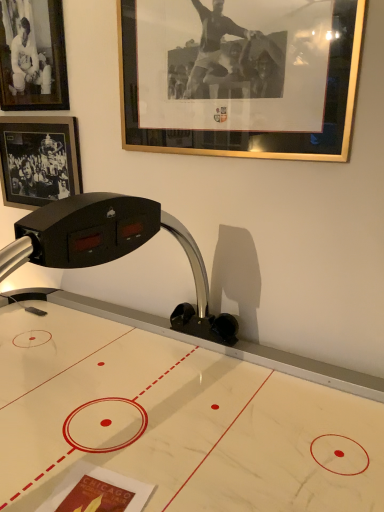
The height and width of the screenshot is (512, 384). Describe the element at coordinates (32, 56) in the screenshot. I see `matte black photo frame at upper left, positioned as the 2th picture frame in right-to-left order` at that location.

Identify the location of black matte picture frame at upper left, the first picture frame when ordered from left to right. (39, 160).

This screenshot has height=512, width=384. In order to click on white glossy air hockey table at center in this screenshot , I will do `click(175, 421)`.

The width and height of the screenshot is (384, 512). What do you see at coordinates (240, 76) in the screenshot? I see `gold-framed picture at upper center, placed as the third picture frame when sorted from left to right` at bounding box center [240, 76].

Locate an element on the screen. Image resolution: width=384 pixels, height=512 pixels. matte black photo frame at upper left, which appears as the 2th picture frame when viewed from the left is located at coordinates (32, 56).

Is the position of matte black photo frame at upper left, which appears as the 2th picture frame when viewed from the left, less distant than that of gold-framed picture at upper center, which ranks as the 1th picture frame in right-to-left order?

No.

Does matte black photo frame at upper left, which appears as the 2th picture frame when viewed from the left, have a smaller size compared to gold-framed picture at upper center, which ranks as the 1th picture frame in right-to-left order?

Indeed, matte black photo frame at upper left, which appears as the 2th picture frame when viewed from the left, has a smaller size compared to gold-framed picture at upper center, which ranks as the 1th picture frame in right-to-left order.

Locate an element on the screen. This screenshot has width=384, height=512. picture frame in front of the matte black photo frame at upper left, which appears as the 2th picture frame when viewed from the left is located at coordinates (240, 76).

How different are the orientations of matte black photo frame at upper left, positioned as the 2th picture frame in right-to-left order, and gold-framed picture at upper center, which ranks as the 1th picture frame in right-to-left order, in degrees?

The facing directions of matte black photo frame at upper left, positioned as the 2th picture frame in right-to-left order, and gold-framed picture at upper center, which ranks as the 1th picture frame in right-to-left order, are 0.0114 degrees apart.

Find the location of a particular element. This screenshot has height=512, width=384. picture frame that is the 2nd one above the white glossy air hockey table at center (from a real-world perspective) is located at coordinates (240, 76).

From the picture: What's the angular difference between gold-framed picture at upper center, which ranks as the 1th picture frame in right-to-left order, and white glossy air hockey table at center's facing directions?

gold-framed picture at upper center, which ranks as the 1th picture frame in right-to-left order, and white glossy air hockey table at center are facing 0.368 degrees away from each other.

From the picture: In terms of height, does gold-framed picture at upper center, which ranks as the 1th picture frame in right-to-left order, look taller or shorter compared to white glossy air hockey table at center?

Considering their sizes, gold-framed picture at upper center, which ranks as the 1th picture frame in right-to-left order, has less height than white glossy air hockey table at center.

Is point (277, 61) closer to viewer compared to point (40, 305)?

That is True.

Does black matte picture frame at upper left, arranged as the third picture frame when viewed from the right, have a lesser height compared to gold-framed picture at upper center, which ranks as the 1th picture frame in right-to-left order?

Indeed, black matte picture frame at upper left, arranged as the third picture frame when viewed from the right, has a lesser height compared to gold-framed picture at upper center, which ranks as the 1th picture frame in right-to-left order.

Is black matte picture frame at upper left, the first picture frame when ordered from left to right, aimed at gold-framed picture at upper center, which ranks as the 1th picture frame in right-to-left order?

No, black matte picture frame at upper left, the first picture frame when ordered from left to right, is not aimed at gold-framed picture at upper center, which ranks as the 1th picture frame in right-to-left order.

Would you say gold-framed picture at upper center, which ranks as the 1th picture frame in right-to-left order, is part of black matte picture frame at upper left, arranged as the third picture frame when viewed from the right,'s contents?

That's incorrect, gold-framed picture at upper center, which ranks as the 1th picture frame in right-to-left order, is not inside black matte picture frame at upper left, arranged as the third picture frame when viewed from the right.

Is gold-framed picture at upper center, which ranks as the 1th picture frame in right-to-left order, spatially inside matte black photo frame at upper left, which appears as the 2th picture frame when viewed from the left, or outside of it?

The correct answer is: outside.

From a real-world perspective, who is located higher, gold-framed picture at upper center, placed as the third picture frame when sorted from left to right, or matte black photo frame at upper left, positioned as the 2th picture frame in right-to-left order?

matte black photo frame at upper left, positioned as the 2th picture frame in right-to-left order, from a real-world perspective.

At what (x,y) coordinates should I click in order to perform the action: click on picture frame on the right of the matte black photo frame at upper left, which appears as the 2th picture frame when viewed from the left. Please return your answer as a coordinate pair (x, y). Looking at the image, I should click on (240, 76).

From the image's perspective, is gold-framed picture at upper center, which ranks as the 1th picture frame in right-to-left order, below matte black photo frame at upper left, which appears as the 2th picture frame when viewed from the left?

Correct, gold-framed picture at upper center, which ranks as the 1th picture frame in right-to-left order, appears lower than matte black photo frame at upper left, which appears as the 2th picture frame when viewed from the left, in the image.

Which object is thinner, white glossy air hockey table at center or matte black photo frame at upper left, positioned as the 2th picture frame in right-to-left order?

matte black photo frame at upper left, positioned as the 2th picture frame in right-to-left order, is thinner.

Which is more to the left, white glossy air hockey table at center or matte black photo frame at upper left, which appears as the 2th picture frame when viewed from the left?

From the viewer's perspective, matte black photo frame at upper left, which appears as the 2th picture frame when viewed from the left, appears more on the left side.

Does white glossy air hockey table at center have a smaller size compared to matte black photo frame at upper left, positioned as the 2th picture frame in right-to-left order?

Incorrect, white glossy air hockey table at center is not smaller in size than matte black photo frame at upper left, positioned as the 2th picture frame in right-to-left order.

From the picture: How many degrees apart are the facing directions of white glossy air hockey table at center and gold-framed picture at upper center, placed as the third picture frame when sorted from left to right?

0.368 degrees.

Consider the image. Who is more distant, white glossy air hockey table at center or gold-framed picture at upper center, which ranks as the 1th picture frame in right-to-left order?

gold-framed picture at upper center, which ranks as the 1th picture frame in right-to-left order.

This screenshot has width=384, height=512. Identify the location of table below the gold-framed picture at upper center, which ranks as the 1th picture frame in right-to-left order (from a real-world perspective). pos(175,421).

Does black matte picture frame at upper left, arranged as the third picture frame when viewed from the right, contain matte black photo frame at upper left, which appears as the 2th picture frame when viewed from the left?

No, matte black photo frame at upper left, which appears as the 2th picture frame when viewed from the left, is located outside of black matte picture frame at upper left, arranged as the third picture frame when viewed from the right.

From a real-world perspective, does black matte picture frame at upper left, the first picture frame when ordered from left to right, sit lower than matte black photo frame at upper left, which appears as the 2th picture frame when viewed from the left?

Correct, in the physical world, black matte picture frame at upper left, the first picture frame when ordered from left to right, is lower than matte black photo frame at upper left, which appears as the 2th picture frame when viewed from the left.

From a real-world perspective, count 2nd picture frames upward from the black matte picture frame at upper left, the first picture frame when ordered from left to right, and point to it. Please provide its 2D coordinates.

[(32, 56)]

You are a GUI agent. You are given a task and a screenshot of the screen. Output one action in this format:
    pyautogui.click(x=<x>, y=<y>)
    Task: Click on the 1st picture frame below when counting from the matte black photo frame at upper left, which appears as the 2th picture frame when viewed from the left (from the image's perspective)
    This screenshot has width=384, height=512.
    Given the screenshot: What is the action you would take?
    pyautogui.click(x=240, y=76)

From the image's perspective, count 2nd picture frames upward from the white glossy air hockey table at center and point to it. Please provide its 2D coordinates.

[(240, 76)]

In the scene shown: Considering their positions, is matte black photo frame at upper left, positioned as the 2th picture frame in right-to-left order, positioned closer to gold-framed picture at upper center, which ranks as the 1th picture frame in right-to-left order, than black matte picture frame at upper left, the first picture frame when ordered from left to right?

Among the two, matte black photo frame at upper left, positioned as the 2th picture frame in right-to-left order, is located nearer to gold-framed picture at upper center, which ranks as the 1th picture frame in right-to-left order.

Considering their positions, is white glossy air hockey table at center positioned closer to black matte picture frame at upper left, arranged as the third picture frame when viewed from the right, than matte black photo frame at upper left, which appears as the 2th picture frame when viewed from the left?

matte black photo frame at upper left, which appears as the 2th picture frame when viewed from the left, is positioned closer to the anchor black matte picture frame at upper left, arranged as the third picture frame when viewed from the right.

Which object lies further to the anchor point matte black photo frame at upper left, which appears as the 2th picture frame when viewed from the left, gold-framed picture at upper center, placed as the third picture frame when sorted from left to right, or black matte picture frame at upper left, arranged as the third picture frame when viewed from the right?

gold-framed picture at upper center, placed as the third picture frame when sorted from left to right, is positioned further to the anchor matte black photo frame at upper left, which appears as the 2th picture frame when viewed from the left.

Estimate the real-world distances between objects in this image. Which object is closer to black matte picture frame at upper left, arranged as the third picture frame when viewed from the right, matte black photo frame at upper left, positioned as the 2th picture frame in right-to-left order, or white glossy air hockey table at center?

matte black photo frame at upper left, positioned as the 2th picture frame in right-to-left order, lies closer to black matte picture frame at upper left, arranged as the third picture frame when viewed from the right, than the other object.

From the image, which object appears to be nearer to black matte picture frame at upper left, the first picture frame when ordered from left to right, white glossy air hockey table at center or gold-framed picture at upper center, placed as the third picture frame when sorted from left to right?

Based on the image, gold-framed picture at upper center, placed as the third picture frame when sorted from left to right, appears to be nearer to black matte picture frame at upper left, the first picture frame when ordered from left to right.

From the picture: Estimate the real-world distances between objects in this image. Which object is further from gold-framed picture at upper center, placed as the third picture frame when sorted from left to right, matte black photo frame at upper left, positioned as the 2th picture frame in right-to-left order, or white glossy air hockey table at center?

Among the two, white glossy air hockey table at center is located further to gold-framed picture at upper center, placed as the third picture frame when sorted from left to right.

From the picture: Based on their spatial positions, is matte black photo frame at upper left, positioned as the 2th picture frame in right-to-left order, or gold-framed picture at upper center, placed as the third picture frame when sorted from left to right, closer to black matte picture frame at upper left, the first picture frame when ordered from left to right?

The object closer to black matte picture frame at upper left, the first picture frame when ordered from left to right, is matte black photo frame at upper left, positioned as the 2th picture frame in right-to-left order.

Considering their positions, is white glossy air hockey table at center positioned closer to gold-framed picture at upper center, placed as the third picture frame when sorted from left to right, than matte black photo frame at upper left, positioned as the 2th picture frame in right-to-left order?

matte black photo frame at upper left, positioned as the 2th picture frame in right-to-left order, lies closer to gold-framed picture at upper center, placed as the third picture frame when sorted from left to right, than the other object.

Where is `picture frame located between white glossy air hockey table at center and matte black photo frame at upper left, positioned as the 2th picture frame in right-to-left order, in the depth direction`? picture frame located between white glossy air hockey table at center and matte black photo frame at upper left, positioned as the 2th picture frame in right-to-left order, in the depth direction is located at coordinates (240, 76).

This screenshot has height=512, width=384. I want to click on picture frame located between black matte picture frame at upper left, the first picture frame when ordered from left to right, and gold-framed picture at upper center, placed as the third picture frame when sorted from left to right, in the left-right direction, so click(32, 56).